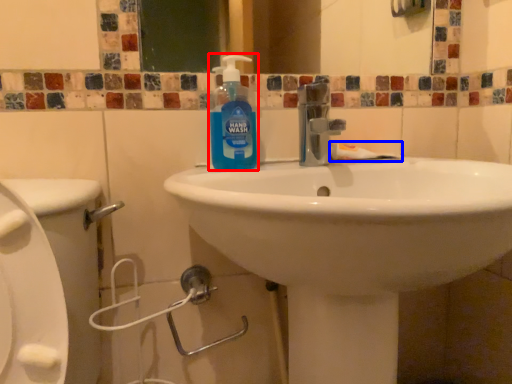
Question: Which of the following is the farthest to the observer, cleaning product (highlighted by a red box) or toothpaste (highlighted by a blue box)?

Choices:
 (A) cleaning product
 (B) toothpaste

Answer: (B)